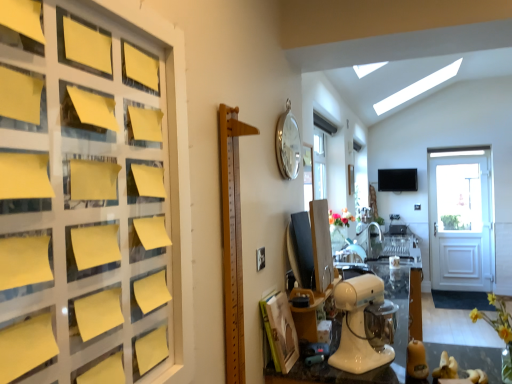
This screenshot has width=512, height=384. What do you see at coordinates (358, 325) in the screenshot?
I see `white glossy stand mixer at center` at bounding box center [358, 325].

Locate an element on the screen. white glossy stand mixer at center is located at coordinates (358, 325).

What do you see at coordinates (288, 144) in the screenshot? I see `silver metallic clock at upper center` at bounding box center [288, 144].

What do you see at coordinates (496, 318) in the screenshot? The height and width of the screenshot is (384, 512). I see `yellow matte flower at lower right, marked as the first flower in a bottom-to-top arrangement` at bounding box center [496, 318].

This screenshot has height=384, width=512. Find the location of `transparent glass table at lower right`. transparent glass table at lower right is located at coordinates (463, 361).

You are a GUI agent. You are given a task and a screenshot of the screen. Output one action in this format:
    pyautogui.click(x=<x>, y=<y>)
    Task: Click on the floral bouquet at center, the first flower in the top-to-bottom sequence
    Image resolution: width=512 pixels, height=384 pixels.
    Given the screenshot: What is the action you would take?
    pyautogui.click(x=341, y=218)

Locate an element on the screen. The image size is (512, 384). yellow rubber duck at lower right is located at coordinates (417, 360).

Identify the location of white glossy stand mixer at center. Image resolution: width=512 pixels, height=384 pixels. (358, 325).

Is white glossy stand mixer at center far away from silver metallic clock at upper center?

No, white glossy stand mixer at center is not far from silver metallic clock at upper center.

Is point (334, 295) less distant than point (284, 124)?

That is True.

Is white glossy stand mixer at center positioned with its back to silver metallic clock at upper center?

white glossy stand mixer at center is not turned away from silver metallic clock at upper center.

From a real-world perspective, does yellow matte flower at lower right, the second flower in the top-to-bottom sequence, sit lower than white glossy stand mixer at center?

Indeed, from a real-world perspective, yellow matte flower at lower right, the second flower in the top-to-bottom sequence, is positioned beneath white glossy stand mixer at center.

At what (x,y) coordinates should I click in order to perform the action: click on appliance that appears above the yellow matte flower at lower right, the first flower viewed from the front (from a real-world perspective). Please return your answer as a coordinate pair (x, y). Looking at the image, I should click on (358, 325).

From the image's perspective, which one is positioned lower, yellow matte flower at lower right, marked as the first flower in a bottom-to-top arrangement, or white glossy stand mixer at center?

yellow matte flower at lower right, marked as the first flower in a bottom-to-top arrangement, appears lower in the image.

In terms of size, does yellow matte flower at lower right, the second flower in the top-to-bottom sequence, appear bigger or smaller than white glossy stand mixer at center?

Clearly, yellow matte flower at lower right, the second flower in the top-to-bottom sequence, is smaller in size than white glossy stand mixer at center.

Based on their sizes in the image, would you say wooden ruler at center is bigger or smaller than yellow rubber duck at lower right?

Clearly, wooden ruler at center is larger in size than yellow rubber duck at lower right.

Is point (227, 296) closer or farther from the camera than point (425, 366)?

Point (227, 296) is closer to the camera than point (425, 366).

Is wooden ruler at center positioned beyond the bounds of yellow rubber duck at lower right?

Yes.

From the image's perspective, who appears lower, wooden ruler at center or yellow rubber duck at lower right?

yellow rubber duck at lower right.

Is point (370, 300) in front of point (411, 375)?

Yes, point (370, 300) is closer to viewer.

Considering the relative positions of white glossy stand mixer at center and yellow rubber duck at lower right in the image provided, is white glossy stand mixer at center to the right of yellow rubber duck at lower right from the viewer's perspective?

No.

From a real-world perspective, which object stands above the other?

From a 3D spatial view, white glossy stand mixer at center is above.

Is white glossy stand mixer at center oriented away from yellow rubber duck at lower right?

white glossy stand mixer at center does not have its back to yellow rubber duck at lower right.

Where is `the 2nd flower counting from the right side of the yellow paper at left`? the 2nd flower counting from the right side of the yellow paper at left is located at coordinates (496, 318).

Is point (502, 315) positioned behind point (165, 136)?

Yes, it is behind point (165, 136).

Does yellow matte flower at lower right, the first flower viewed from the front, have a greater width compared to yellow paper at left?

Yes, yellow matte flower at lower right, the first flower viewed from the front, is wider than yellow paper at left.

Between yellow matte flower at lower right, the second flower in the top-to-bottom sequence, and yellow paper at left, which one has smaller size?

yellow matte flower at lower right, the second flower in the top-to-bottom sequence.

From the picture: Which is in front, yellow matte flower at lower right, marked as the first flower in a bottom-to-top arrangement, or yellow rubber duck at lower right?

yellow matte flower at lower right, marked as the first flower in a bottom-to-top arrangement, is in front.

Is yellow matte flower at lower right, the second flower in the top-to-bottom sequence, situated inside yellow rubber duck at lower right or outside?

yellow matte flower at lower right, the second flower in the top-to-bottom sequence, is outside yellow rubber duck at lower right.

Is yellow matte flower at lower right, marked as the first flower in a bottom-to-top arrangement, not close to yellow rubber duck at lower right?

No, there isn't a large distance between yellow matte flower at lower right, marked as the first flower in a bottom-to-top arrangement, and yellow rubber duck at lower right.

From a real-world perspective, which is physically above, yellow paper at left or white glossy stand mixer at center?

yellow paper at left.

Consider the image. Considering the sizes of objects yellow paper at left and white glossy stand mixer at center in the image provided, who is taller, yellow paper at left or white glossy stand mixer at center?

With more height is yellow paper at left.

Which of these two, yellow paper at left or white glossy stand mixer at center, is wider?

With larger width is white glossy stand mixer at center.

Is yellow paper at left at the right side of white glossy stand mixer at center?

No, yellow paper at left is not to the right of white glossy stand mixer at center.

There is a white glossy stand mixer at center. At what (x,y) coordinates should I click in order to perform the action: click on clock above it (from a real-world perspective). Please return your answer as a coordinate pair (x, y). Looking at the image, I should click on (288, 144).

Find the location of a particular element. appliance that appears in front of the yellow matte flower at lower right, which appears as the 2th flower when viewed from the back is located at coordinates (358, 325).

Estimate the real-world distances between objects in this image. Which object is further from white glossy stand mixer at center, transparent glass table at lower right or yellow rubber duck at lower right?

The object further to white glossy stand mixer at center is transparent glass table at lower right.

When comparing their distances from floral bouquet at center, marked as the 1th flower in a back-to-front arrangement, does transparent glass table at lower right or yellow matte flower at lower right, marked as the first flower in a bottom-to-top arrangement, seem further?

The object further to floral bouquet at center, marked as the 1th flower in a back-to-front arrangement, is yellow matte flower at lower right, marked as the first flower in a bottom-to-top arrangement.

Which object lies nearer to the anchor point white glossy stand mixer at center, floral bouquet at center, the first flower in the top-to-bottom sequence, or yellow rubber duck at lower right?

yellow rubber duck at lower right.

Looking at this image, when comparing their distances from floral bouquet at center, the 2th flower ordered from the bottom, does yellow rubber duck at lower right or transparent glass table at lower right seem further?

Among the two, yellow rubber duck at lower right is located further to floral bouquet at center, the 2th flower ordered from the bottom.

When comparing their distances from yellow paper at left, does yellow matte flower at lower right, the first flower viewed from the front, or wooden ruler at center seem further?

yellow matte flower at lower right, the first flower viewed from the front, lies further to yellow paper at left than the other object.

Looking at the image, which one is located further to floral bouquet at center, the 2th flower ordered from the bottom, yellow rubber duck at lower right or wooden ruler at center?

wooden ruler at center is positioned further to the anchor floral bouquet at center, the 2th flower ordered from the bottom.

Which object lies nearer to the anchor point yellow paper at left, white glossy stand mixer at center or silver metallic clock at upper center?

white glossy stand mixer at center is closer to yellow paper at left.

From the image, which object appears to be nearer to yellow matte flower at lower right, which appears as the 2th flower when viewed from the back, yellow rubber duck at lower right or silver metallic clock at upper center?

yellow rubber duck at lower right.

Where is `glass table between wooden ruler at center and yellow matte flower at lower right, the second flower in the top-to-bottom sequence, in the horizontal direction`? glass table between wooden ruler at center and yellow matte flower at lower right, the second flower in the top-to-bottom sequence, in the horizontal direction is located at coordinates (463, 361).

Locate an element on the screen. appliance between silver metallic clock at upper center and yellow matte flower at lower right, the first flower viewed from the front, vertically is located at coordinates (358, 325).

Find the location of a particular element. Image resolution: width=512 pixels, height=384 pixels. flower between yellow paper at left and floral bouquet at center, acting as the 2th flower starting from the front, along the z-axis is located at coordinates (496, 318).

Identify the location of toy between wooden ruler at center and floral bouquet at center, the first flower in the top-to-bottom sequence, in the front-back direction. This screenshot has height=384, width=512. (417, 360).